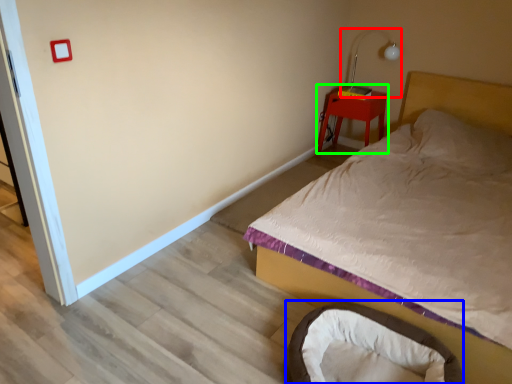
Question: Which object is positioned closest to table lamp (highlighted by a red box)? Select from infant bed (highlighted by a blue box) and nightstand (highlighted by a green box).

Choices:
 (A) infant bed
 (B) nightstand

Answer: (B)